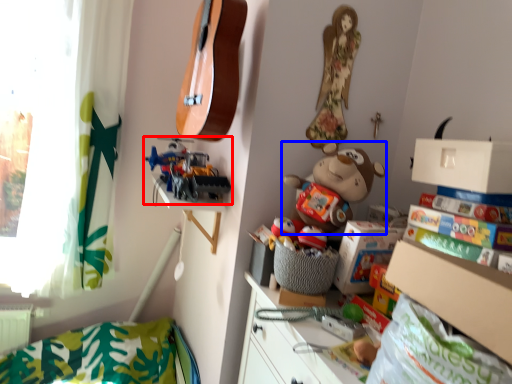
Question: Among these objects, which one is farthest to the camera, toy (highlighted by a red box) or toy (highlighted by a blue box)?

Choices:
 (A) toy
 (B) toy

Answer: (A)